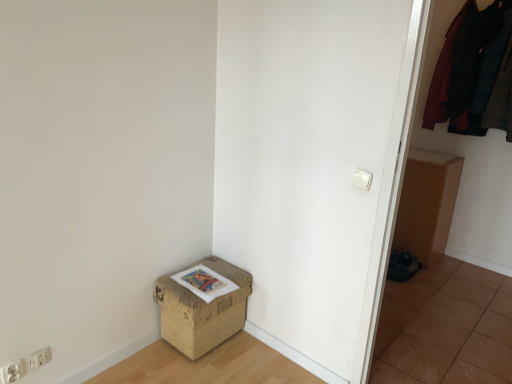
Question: Considering the positions of dark woolen sweater at upper right, marked as the 1th clothing in a left-to-right arrangement, and brown tile at lower right in the image, is dark woolen sweater at upper right, marked as the 1th clothing in a left-to-right arrangement, taller or shorter than brown tile at lower right?

Choices:
 (A) tall
 (B) short

Answer: (A)

Question: From the image's perspective, is dark woolen sweater at upper right, marked as the 1th clothing in a left-to-right arrangement, located above or below brown tile at lower right?

Choices:
 (A) below
 (B) above

Answer: (B)

Question: Which object is positioned farthest from the white plastic electric outlet at lower left, placed as the first electric outlet when sorted from left to right?

Choices:
 (A) brown tile at lower right
 (B) dark woolen sweater at upper right, the second clothing in the right-to-left sequence
 (C) brown cardboard box at lower right
 (D) brown cardboard box at lower left
 (E) white plastic electric outlet at lower left, positioned as the 1th electric outlet in right-to-left order

Answer: (B)

Question: Which is farther from the dark woolen sweater at upper right, which is the 1th clothing from right to left?

Choices:
 (A) brown tile at lower right
 (B) white plastic light switch at upper right
 (C) white plastic electric outlet at lower left, the 2th electric outlet positioned from the back
 (D) brown cardboard box at lower left
 (E) white plastic electric outlet at lower left, positioned as the 1th electric outlet in right-to-left order

Answer: (C)